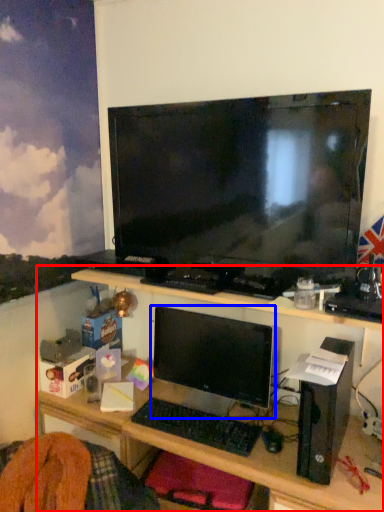
Question: Which of the following is the farthest to the observer, desk (highlighted by a red box) or computer monitor (highlighted by a blue box)?

Choices:
 (A) desk
 (B) computer monitor

Answer: (B)